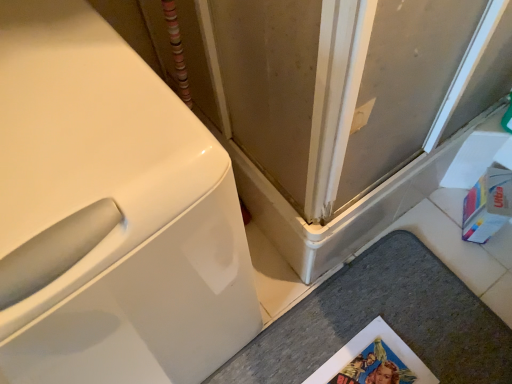
Question: Should I look upward or downward to see white glossy washing machine at left?

Choices:
 (A) down
 (B) up

Answer: (A)

Question: Can you confirm if white glossy washing machine at left is positioned to the right of gray carpet at lower center?

Choices:
 (A) no
 (B) yes

Answer: (A)

Question: Can you confirm if white glossy washing machine at left is taller than gray carpet at lower center?

Choices:
 (A) no
 (B) yes

Answer: (B)

Question: Considering the relative sizes of white glossy washing machine at left and gray carpet at lower center in the image provided, is white glossy washing machine at left shorter than gray carpet at lower center?

Choices:
 (A) no
 (B) yes

Answer: (A)

Question: Can you confirm if white glossy washing machine at left is wider than gray carpet at lower center?

Choices:
 (A) no
 (B) yes

Answer: (B)

Question: Is white glossy washing machine at left positioned behind gray carpet at lower center?

Choices:
 (A) yes
 (B) no

Answer: (B)

Question: Does white glossy washing machine at left contain gray carpet at lower center?

Choices:
 (A) no
 (B) yes

Answer: (A)

Question: Is gray carpet at lower center positioned behind white glossy washing machine at left?

Choices:
 (A) no
 (B) yes

Answer: (B)

Question: Is white glossy washing machine at left inside gray carpet at lower center?

Choices:
 (A) yes
 (B) no

Answer: (B)

Question: Is gray carpet at lower center positioned beyond the bounds of white glossy washing machine at left?

Choices:
 (A) no
 (B) yes

Answer: (B)

Question: Does gray carpet at lower center have a greater width compared to white glossy washing machine at left?

Choices:
 (A) no
 (B) yes

Answer: (A)

Question: From a real-world perspective, is gray carpet at lower center on top of white glossy washing machine at left?

Choices:
 (A) no
 (B) yes

Answer: (A)

Question: Considering the relative sizes of gray carpet at lower center and white glossy washing machine at left in the image provided, is gray carpet at lower center thinner than white glossy washing machine at left?

Choices:
 (A) yes
 (B) no

Answer: (A)

Question: Is gray carpet at lower center inside or outside of white glossy washing machine at left?

Choices:
 (A) outside
 (B) inside

Answer: (A)